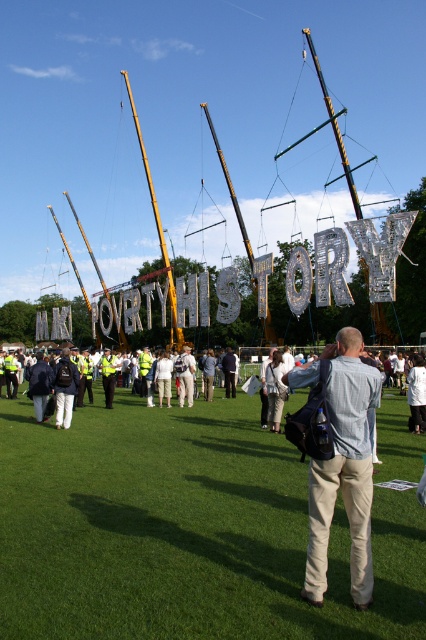
Question: Which point is closer to the camera taking this photo?

Choices:
 (A) (267, 336)
 (B) (152, 195)

Answer: (A)

Question: Can you confirm if light blue shirt at center is smaller than black polished wood mast at center?

Choices:
 (A) no
 (B) yes

Answer: (B)

Question: Which of the following is the farthest from the observer?

Choices:
 (A) (83, 236)
 (B) (265, 337)

Answer: (A)

Question: Is green grass at center to the left of yellow metallic mast at center from the viewer's perspective?

Choices:
 (A) yes
 (B) no

Answer: (B)

Question: Observing the image, what is the correct spatial positioning of light blue shirt at center in reference to gold metallic mast at center?

Choices:
 (A) above
 (B) below

Answer: (B)

Question: Which point appears farthest from the camera in this image?

Choices:
 (A) (175, 522)
 (B) (126, 342)
 (C) (147, 172)
 (D) (92, 333)

Answer: (D)